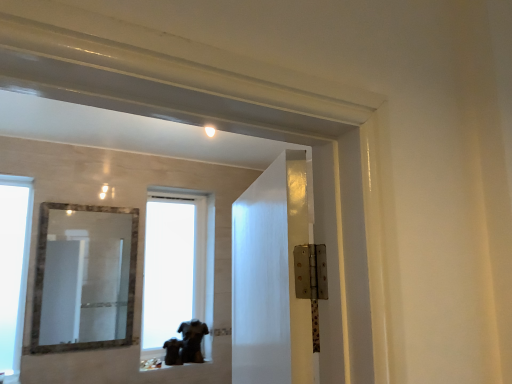
Question: Can you confirm if transparent glass window at center, the 1th window when ordered from back to front, is wider than transparent glass window at left, acting as the 2th window starting from the back?

Choices:
 (A) no
 (B) yes

Answer: (B)

Question: Is transparent glass window at left, placed as the second window when sorted from right to left, surrounded by transparent glass window at center, the 2th window from the front?

Choices:
 (A) yes
 (B) no

Answer: (B)

Question: Is transparent glass window at center, the 2th window from the front, to the left of transparent glass window at left, acting as the 2th window starting from the back, from the viewer's perspective?

Choices:
 (A) yes
 (B) no

Answer: (B)

Question: Could you tell me if transparent glass window at center, the 1th window when ordered from back to front, is facing transparent glass window at left, which appears as the first window when viewed from the front?

Choices:
 (A) no
 (B) yes

Answer: (A)

Question: Considering the relative positions of transparent glass window at center, the 2th window from the front, and transparent glass window at left, placed as the second window when sorted from right to left, in the image provided, is transparent glass window at center, the 2th window from the front, to the right of transparent glass window at left, placed as the second window when sorted from right to left, from the viewer's perspective?

Choices:
 (A) yes
 (B) no

Answer: (A)

Question: From a real-world perspective, is velvety black shirt at lower center above or below transparent glass window at center, placed as the 2th window when sorted from left to right?

Choices:
 (A) below
 (B) above

Answer: (A)

Question: Is velvety black shirt at lower center in front of or behind transparent glass window at center, which is the 1th window from right to left, in the image?

Choices:
 (A) behind
 (B) front

Answer: (A)

Question: Looking at their shapes, would you say velvety black shirt at lower center is wider or thinner than transparent glass window at center, the 1th window when ordered from back to front?

Choices:
 (A) wide
 (B) thin

Answer: (A)

Question: Looking at the image, does velvety black shirt at lower center seem bigger or smaller compared to transparent glass window at center, the 2th window from the front?

Choices:
 (A) small
 (B) big

Answer: (A)

Question: Considering the positions of point (7, 276) and point (86, 284), is point (7, 276) closer or farther from the camera than point (86, 284)?

Choices:
 (A) farther
 (B) closer

Answer: (B)

Question: From a real-world perspective, is transparent glass window at left, acting as the 2th window starting from the back, physically located above or below marble-framed mirror at center?

Choices:
 (A) below
 (B) above

Answer: (A)

Question: In terms of height, does transparent glass window at left, acting as the 2th window starting from the back, look taller or shorter compared to marble-framed mirror at center?

Choices:
 (A) short
 (B) tall

Answer: (B)

Question: Is transparent glass window at left, acting as the 2th window starting from the back, spatially inside marble-framed mirror at center, or outside of it?

Choices:
 (A) outside
 (B) inside

Answer: (A)

Question: From the image's perspective, is transparent glass window at left, which appears as the first window when viewed from the front, above or below velvety black shirt at lower center?

Choices:
 (A) above
 (B) below

Answer: (A)

Question: Is transparent glass window at left, placed as the 1th window when sorted from left to right, in front of or behind velvety black shirt at lower center in the image?

Choices:
 (A) front
 (B) behind

Answer: (A)